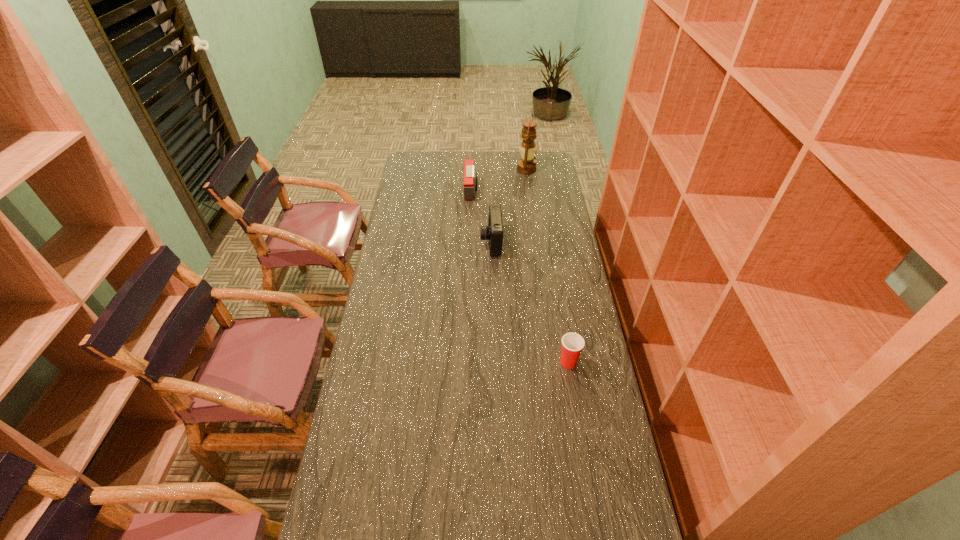
Identify the location of free space located on the front-facing side of the second object from left to right. (464, 242).

Locate an element on the screen. blank space located on the front-facing side of the left camera is located at coordinates (559, 191).

You are a GUI agent. You are given a task and a screenshot of the screen. Output one action in this format:
    pyautogui.click(x=<x>, y=<y>)
    Task: Click on the vacant region located 0.180m on the back of the nearest object
    
    Given the screenshot: What is the action you would take?
    pyautogui.click(x=560, y=312)

Where is `object that is at the far edge`? This screenshot has width=960, height=540. object that is at the far edge is located at coordinates (527, 165).

The image size is (960, 540). I want to click on oil lamp that is at the right edge, so tap(527, 165).

Find the location of `Dixie cup present at the right edge`. Dixie cup present at the right edge is located at coordinates (572, 343).

At what (x,y) coordinates should I click in order to perform the action: click on object positioned at the far right corner. Please return your answer as a coordinate pair (x, y). The height and width of the screenshot is (540, 960). Looking at the image, I should click on (527, 165).

At what (x,y) coordinates should I click in order to perform the action: click on free space at the far edge of the desktop. Please return your answer as a coordinate pair (x, y). The height and width of the screenshot is (540, 960). Looking at the image, I should click on (511, 158).

Where is `blank space at the left edge of the desktop`? blank space at the left edge of the desktop is located at coordinates (420, 258).

Locate an element on the screen. The width and height of the screenshot is (960, 540). vacant space at the right edge of the desktop is located at coordinates pos(607,407).